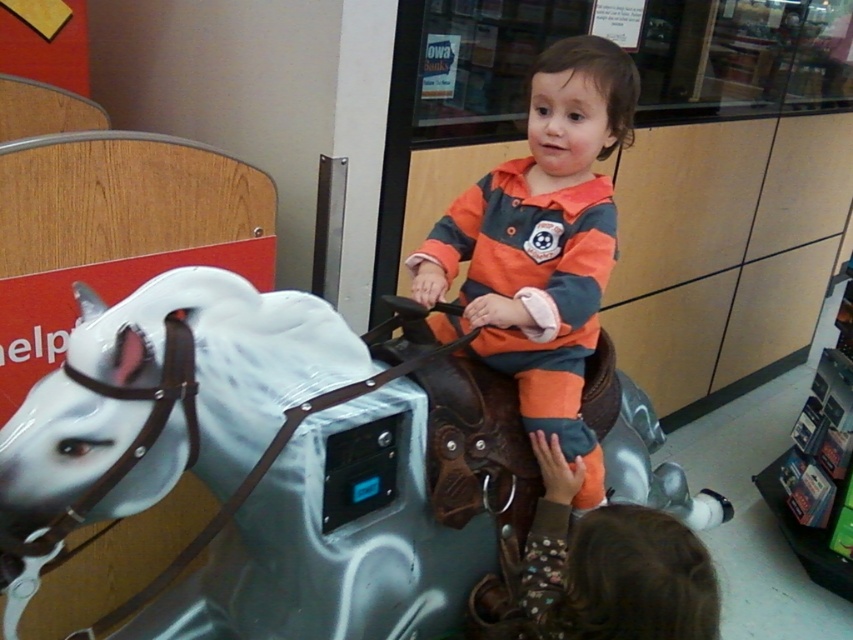
The child is sitting on the white glossy horse at center and wearing the orange striped sweater at center. Which object is taller?

The orange striped sweater at center is taller than the white glossy horse at center.

You are a parent trying to locate your child who is riding the white glossy horse at center in the mall. According to the mall map, the entrance is at coordinate point 0.728, 0.281. Is your child near the entrance?

Yes, the white glossy horse at center is located at point [239,465], which matches the entrance coordinates, so the child is near the entrance.

You are a photographer trying to capture a clear shot of the white glossy horse at center and the orange striped sweater at center. Which object should you focus on first to ensure both are in focus?

You should focus on the white glossy horse at center first because it is closer to the viewer than the orange striped sweater at center. By focusing on the closer object, the sweater will be within the depth of field and also in focus.